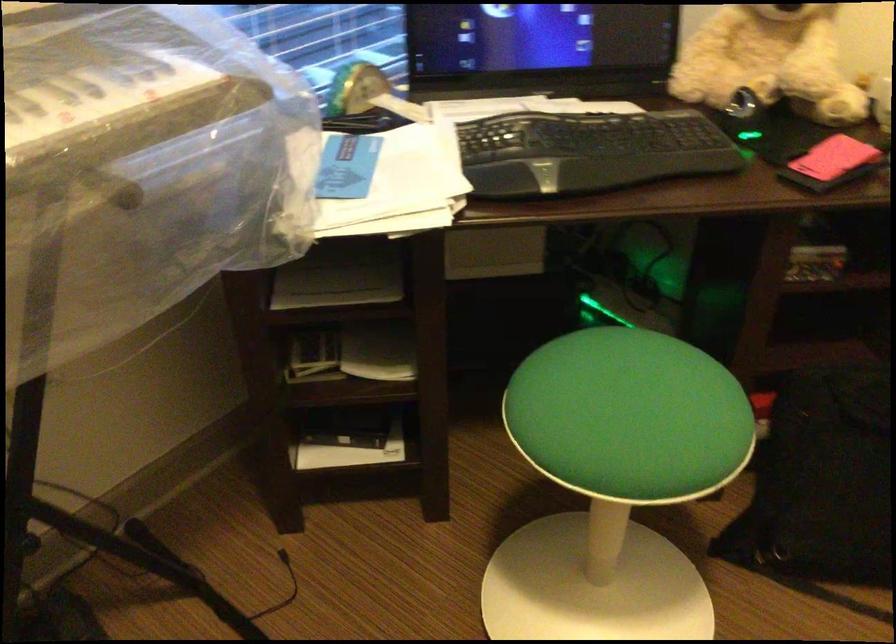
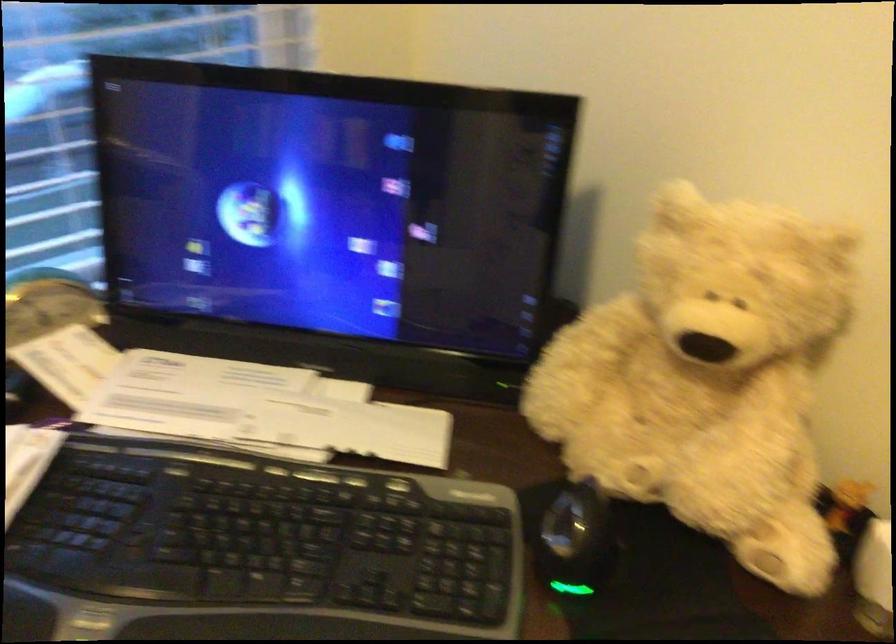
Question: The camera is either moving clockwise (left) or counter-clockwise (right) around the object. The first image is from the beginning of the video and the second image is from the end. Is the camera moving left or right when shooting the video?

Choices:
 (A) Left
 (B) Right

Answer: (B)